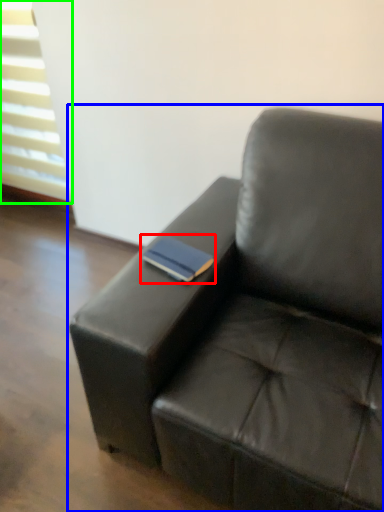
Question: Based on their relative distances, which object is nearer to paperback book (highlighted by a red box)? Choose from studio couch (highlighted by a blue box) and window (highlighted by a green box).

Choices:
 (A) studio couch
 (B) window

Answer: (A)